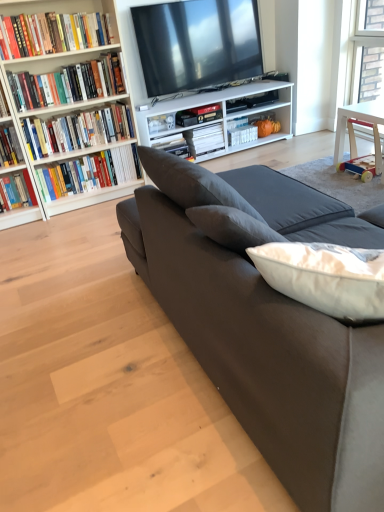
Locate an element on the screen. free space that is to the left of suede couch at center is located at coordinates (81, 321).